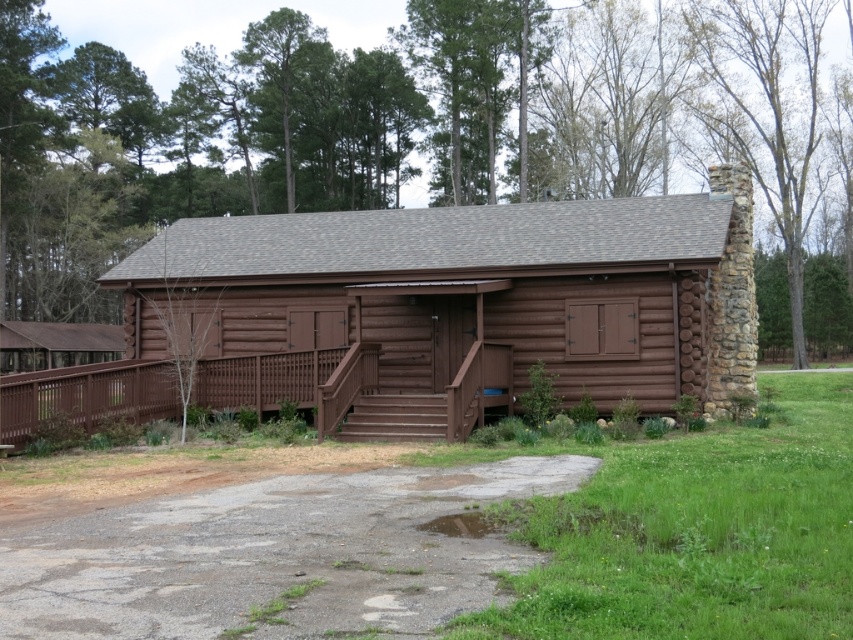
Question: Does gray asphalt driveway at lower center appear over brown wood porch at center?

Choices:
 (A) no
 (B) yes

Answer: (A)

Question: Is brown log cabin at center closer to the viewer compared to brown wood porch at center?

Choices:
 (A) no
 (B) yes

Answer: (A)

Question: Is brown log cabin at center bigger than brown wood porch at center?

Choices:
 (A) yes
 (B) no

Answer: (A)

Question: Among these points, which one is nearest to the camera?

Choices:
 (A) 161,401
 (B) 258,282
 (C) 32,620

Answer: (C)

Question: Among these points, which one is nearest to the camera?

Choices:
 (A) (250, 390)
 (B) (457, 262)

Answer: (B)

Question: Which object is the closest to the gray asphalt driveway at lower center?

Choices:
 (A) brown wood porch at center
 (B) brown log cabin at center

Answer: (A)